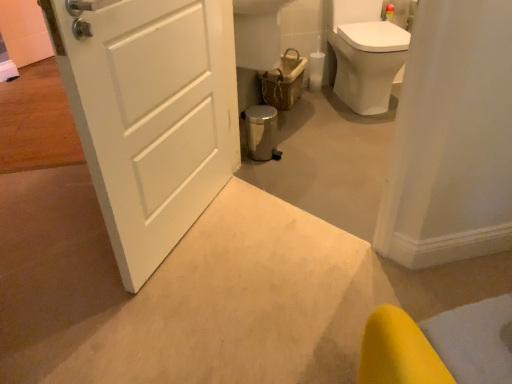
You are a GUI agent. You are given a task and a screenshot of the screen. Output one action in this format:
    pyautogui.click(x=<x>, y=<y>)
    Task: Click on the vacant area to the right of woven brown basket at center
    This screenshot has height=384, width=512.
    Given the screenshot: What is the action you would take?
    pyautogui.click(x=326, y=102)